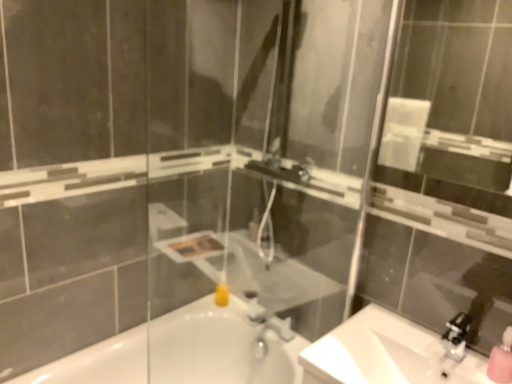
Question: Considering their positions, is white glossy sink at lower right located in front of or behind matte silver faucet at center?

Choices:
 (A) behind
 (B) front

Answer: (B)

Question: From the image's perspective, is white glossy sink at lower right above or below matte silver faucet at center?

Choices:
 (A) above
 (B) below

Answer: (B)

Question: Which is nearer to the matte silver faucet at center?

Choices:
 (A) white glossy bathtub at lower center
 (B) clear glass mirror at upper center
 (C) satin nickel faucet at lower right
 (D) white glossy sink at lower right
 (E) pink matte soap dispenser at lower right

Answer: (A)

Question: Estimate the real-world distances between objects in this image. Which object is farther from the clear glass mirror at upper center?

Choices:
 (A) white glossy sink at lower right
 (B) matte silver faucet at center
 (C) white glossy bathtub at lower center
 (D) pink matte soap dispenser at lower right
 (E) satin nickel faucet at lower right

Answer: (D)